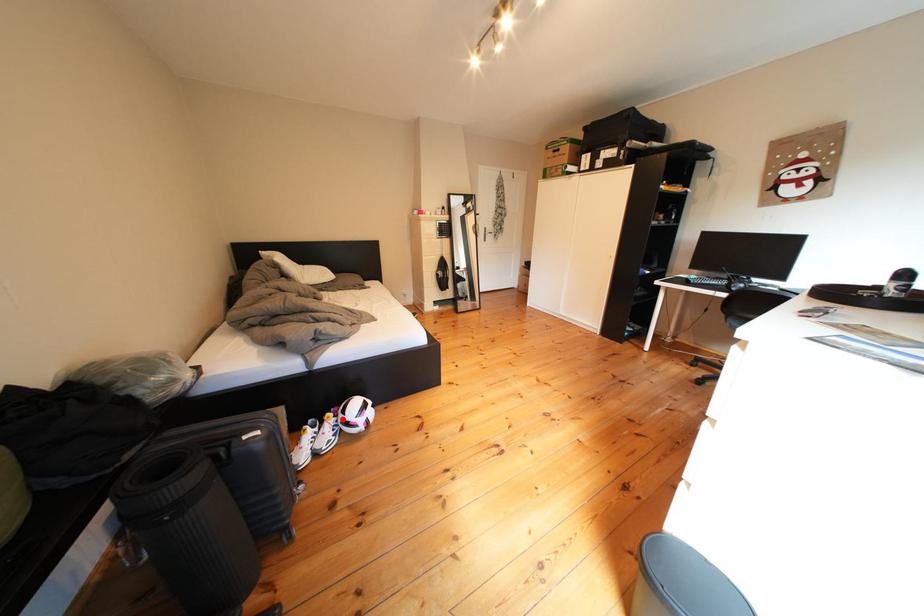
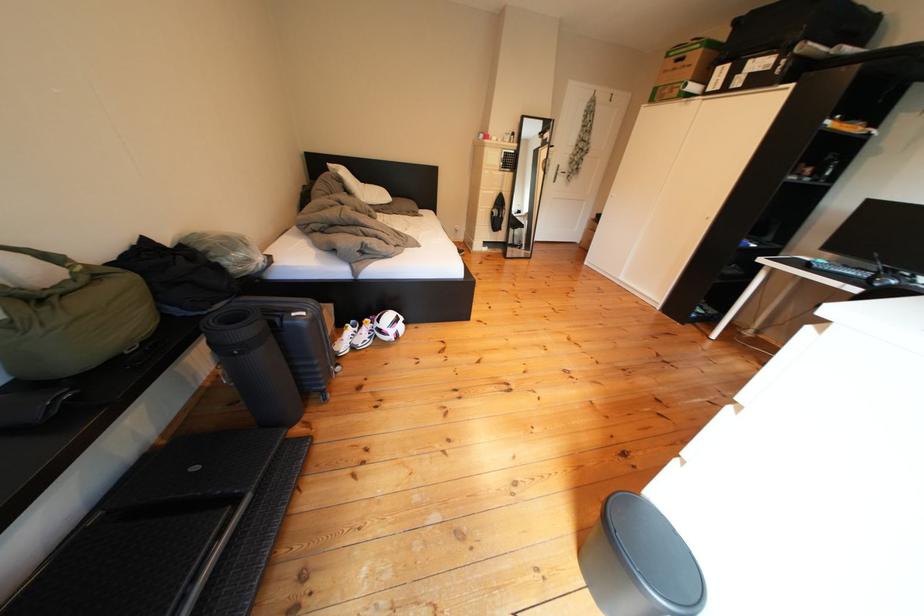
Find the pixel in the second image that matches the highlighted location in the first image.

(381, 325)